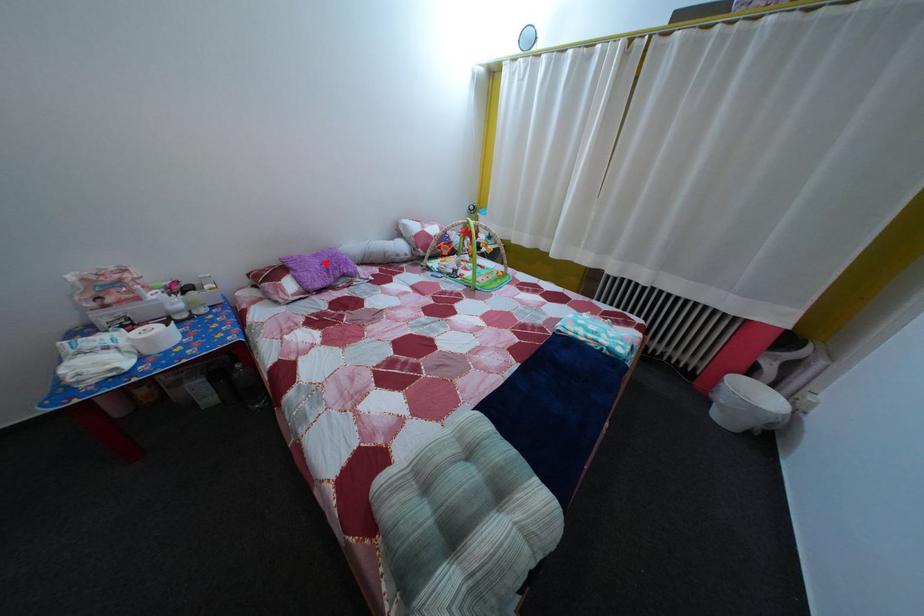
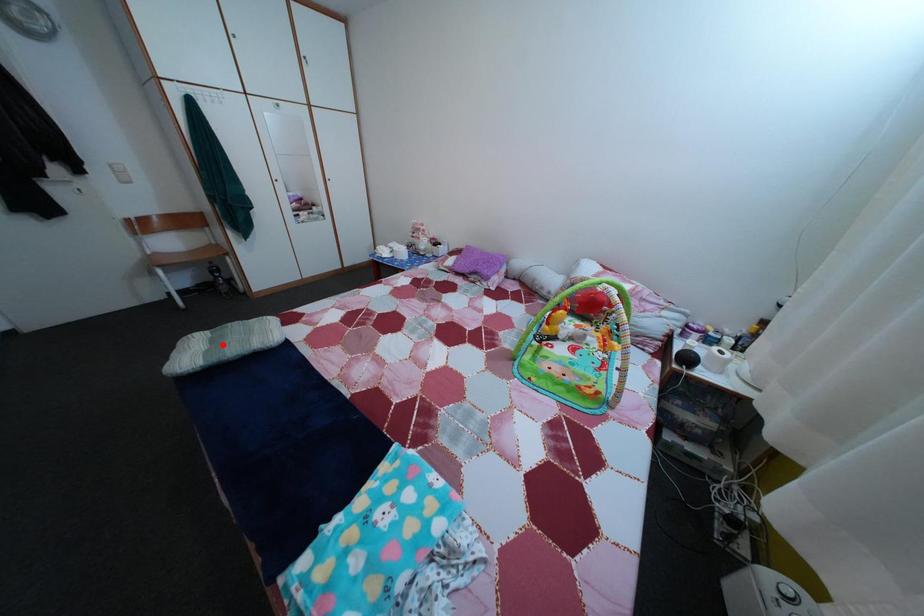
I am providing you with two images of the same scene from different viewpoints. A red point is marked on the first image and another point is marked on the second image. Is the red point in image1 aligned with the point shown in image2?

No